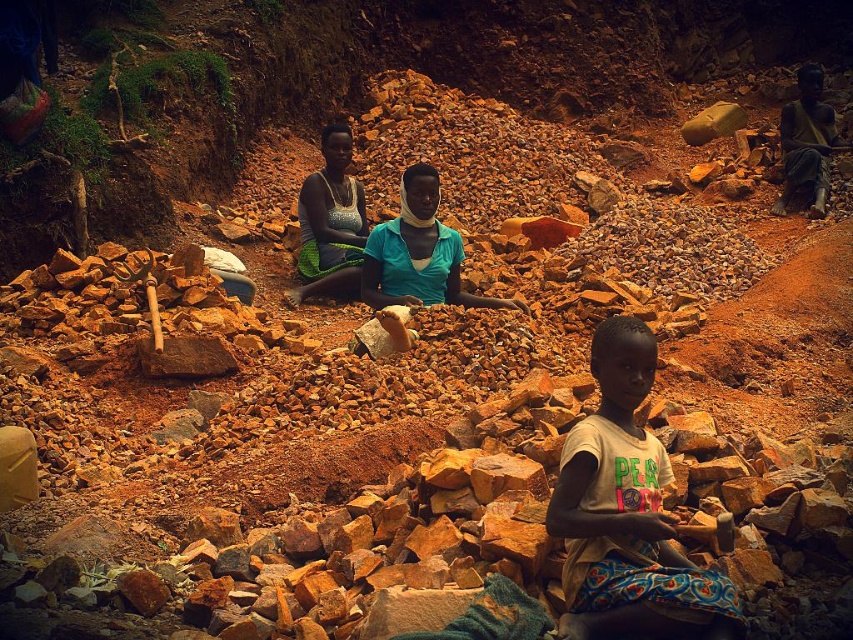
Question: Is shiny metallic necklace at center to the right of dark skin person at right from the viewer's perspective?

Choices:
 (A) no
 (B) yes

Answer: (A)

Question: Estimate the real-world distances between objects in this image. Which object is closer to the light brown cotton shirt at center?

Choices:
 (A) shiny metallic necklace at center
 (B) dark skin person at right

Answer: (A)

Question: Does light brown cotton shirt at center come behind shiny metallic necklace at center?

Choices:
 (A) yes
 (B) no

Answer: (B)

Question: Which of the following is the farthest from the observer?

Choices:
 (A) shiny metallic necklace at center
 (B) light brown cotton shirt at center

Answer: (A)

Question: Can you confirm if shiny metallic necklace at center is smaller than dark skin person at right?

Choices:
 (A) yes
 (B) no

Answer: (A)

Question: Which point appears closest to the camera in this image?

Choices:
 (A) (601, 401)
 (B) (355, 200)

Answer: (A)